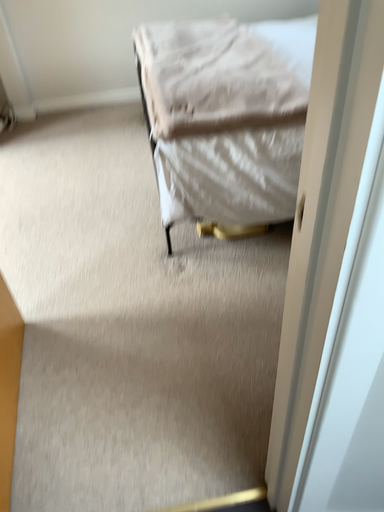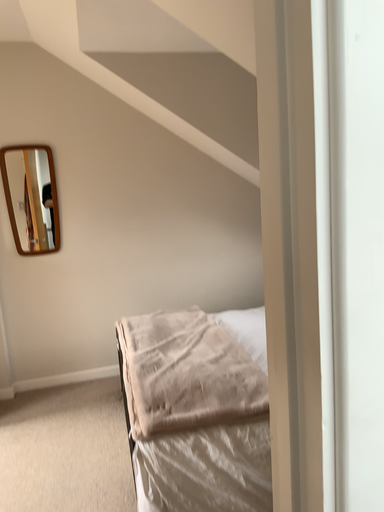
Question: How did the camera likely rotate when shooting the video?

Choices:
 (A) rotated downward
 (B) rotated upward

Answer: (B)